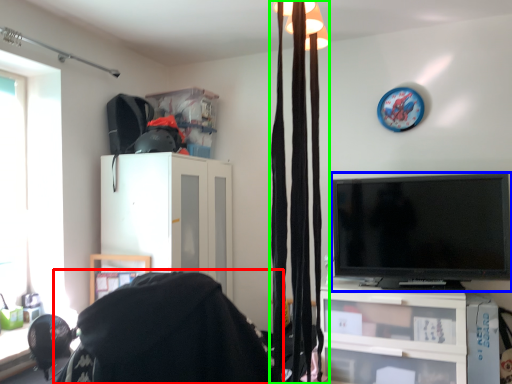
Question: Based on their relative distances, which object is farther from bean bag chair (highlighted by a red box)? Choose from television (highlighted by a blue box) and curtain (highlighted by a green box).

Choices:
 (A) television
 (B) curtain

Answer: (A)